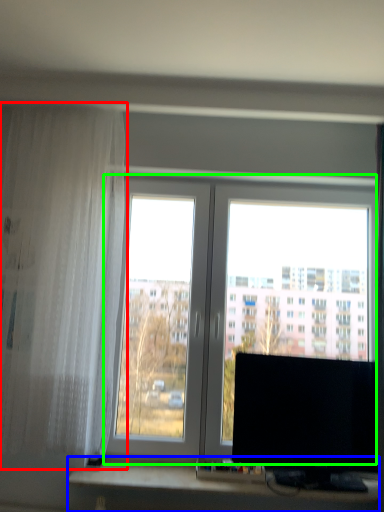
Question: Which object is positioned farthest from curtain (highlighted by a red box)? Select from computer desk (highlighted by a blue box) and window (highlighted by a green box).

Choices:
 (A) computer desk
 (B) window

Answer: (A)